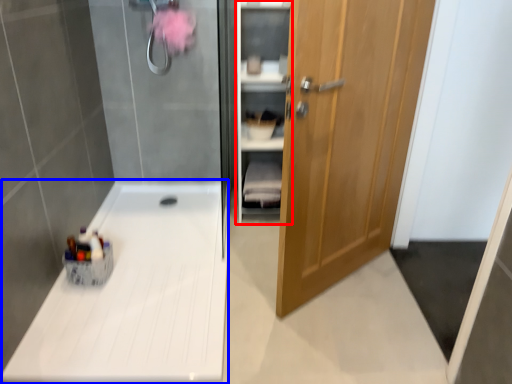
Question: Which point is further to the camera, cabinet (highlighted by a red box) or counter top (highlighted by a blue box)?

Choices:
 (A) cabinet
 (B) counter top

Answer: (A)